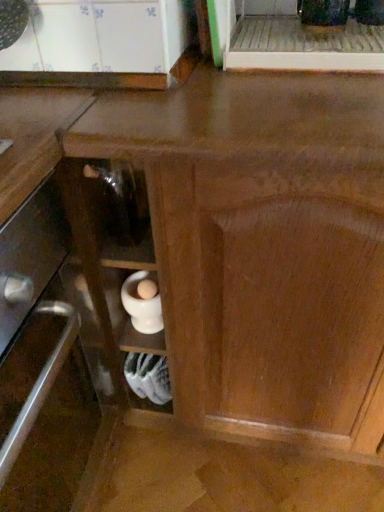
Find the location of a particular element. The height and width of the screenshot is (512, 384). white matte mortar at lower center is located at coordinates point(148,378).

Image resolution: width=384 pixels, height=512 pixels. Describe the element at coordinates (148, 378) in the screenshot. I see `white matte mortar at lower center` at that location.

The height and width of the screenshot is (512, 384). What do you see at coordinates (143, 302) in the screenshot? I see `white glossy mortar at lower center` at bounding box center [143, 302].

Locate an element on the screen. white glossy mortar at lower center is located at coordinates (143, 302).

You are a GUI agent. You are given a task and a screenshot of the screen. Output one action in this format:
    pyautogui.click(x=<x>, y=<y>)
    Task: Click on the white matte mortar at lower center
    The height and width of the screenshot is (512, 384).
    Given the screenshot: What is the action you would take?
    pyautogui.click(x=148, y=378)

Which is more to the left, white glossy mortar at lower center or white matte mortar at lower center?

white matte mortar at lower center is more to the left.

Is white glossy mortar at lower center in front of or behind white matte mortar at lower center in the image?

white glossy mortar at lower center is positioned closer to the viewer than white matte mortar at lower center.

Based on the photo, which is closer, (128,311) or (159,400)?

Clearly, point (128,311) is closer to the camera than point (159,400).

From the image's perspective, is white glossy mortar at lower center under white matte mortar at lower center?

No, from the image's perspective, white glossy mortar at lower center is not below white matte mortar at lower center.

Looking at this image, from a real-world perspective, is white glossy mortar at lower center on top of white matte mortar at lower center?

Indeed, from a real-world perspective, white glossy mortar at lower center stands above white matte mortar at lower center.

Which object is thinner, white glossy mortar at lower center or white matte mortar at lower center?

white glossy mortar at lower center.

From the picture: Does white glossy mortar at lower center have a greater height compared to white matte mortar at lower center?

No, white glossy mortar at lower center is not taller than white matte mortar at lower center.

Who is smaller, white glossy mortar at lower center or white matte mortar at lower center?

With smaller size is white glossy mortar at lower center.

Looking at this image, does white glossy mortar at lower center contain white matte mortar at lower center?

Actually, white matte mortar at lower center is outside white glossy mortar at lower center.

Is white glossy mortar at lower center not close to white matte mortar at lower center?

Actually, white glossy mortar at lower center and white matte mortar at lower center are a little close together.

Is white glossy mortar at lower center aimed at white matte mortar at lower center?

No, white glossy mortar at lower center does not turn towards white matte mortar at lower center.

What's the angular difference between white glossy mortar at lower center and white matte mortar at lower center's facing directions?

The facing directions of white glossy mortar at lower center and white matte mortar at lower center are 1.08 degrees apart.

You are a GUI agent. You are given a task and a screenshot of the screen. Output one action in this format:
    pyautogui.click(x=<x>, y=<y>)
    Task: Click on the shelf below the white glossy mortar at lower center (from a real-world perspective)
    This screenshot has height=512, width=384.
    Given the screenshot: What is the action you would take?
    pyautogui.click(x=148, y=378)

Based on their positions, is white matte mortar at lower center located to the left or right of white glossy mortar at lower center?

Clearly, white matte mortar at lower center is on the left of white glossy mortar at lower center in the image.

Which object is closer to the camera, white matte mortar at lower center or white glossy mortar at lower center?

white glossy mortar at lower center is more forward.

Which is in front, point (130, 364) or point (150, 308)?

The point (150, 308) is closer to the camera.

From the image's perspective, which one is positioned lower, white matte mortar at lower center or white glossy mortar at lower center?

white matte mortar at lower center.

From a real-world perspective, who is located higher, white matte mortar at lower center or white glossy mortar at lower center?

white glossy mortar at lower center.

Which of these two, white matte mortar at lower center or white glossy mortar at lower center, is wider?

With larger width is white matte mortar at lower center.

Does white matte mortar at lower center have a lesser height compared to white glossy mortar at lower center?

No, white matte mortar at lower center is not shorter than white glossy mortar at lower center.

Considering the sizes of white matte mortar at lower center and white glossy mortar at lower center in the image, is white matte mortar at lower center bigger or smaller than white glossy mortar at lower center?

In the image, white matte mortar at lower center appears to be larger than white glossy mortar at lower center.

Which is correct: white matte mortar at lower center is inside white glossy mortar at lower center, or outside of it?

white matte mortar at lower center is spatially situated outside white glossy mortar at lower center.

Is the surface of white matte mortar at lower center in direct contact with white glossy mortar at lower center?

They are not placed beside each other.

Is white matte mortar at lower center oriented away from white glossy mortar at lower center?

No.

Where is `shelf on the left of the white glossy mortar at lower center`? The height and width of the screenshot is (512, 384). shelf on the left of the white glossy mortar at lower center is located at coordinates (148, 378).

This screenshot has width=384, height=512. What are the coordinates of `appliance in front of the white matte mortar at lower center` in the screenshot? It's located at (143, 302).

Identify the location of shelf on the left side of white glossy mortar at lower center. The width and height of the screenshot is (384, 512). (148, 378).